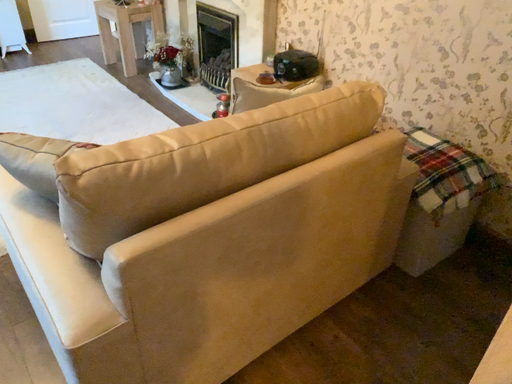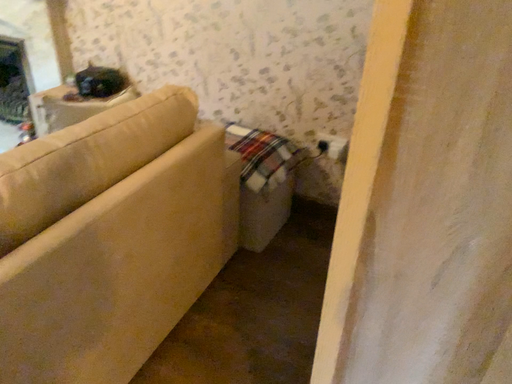
Question: How did the camera likely rotate when shooting the video?

Choices:
 (A) rotated left
 (B) rotated right

Answer: (B)